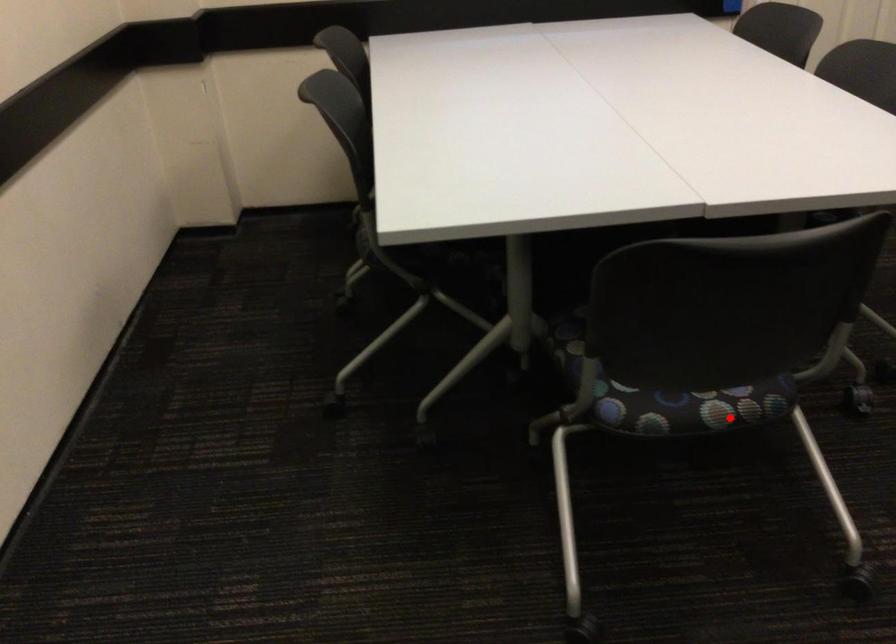
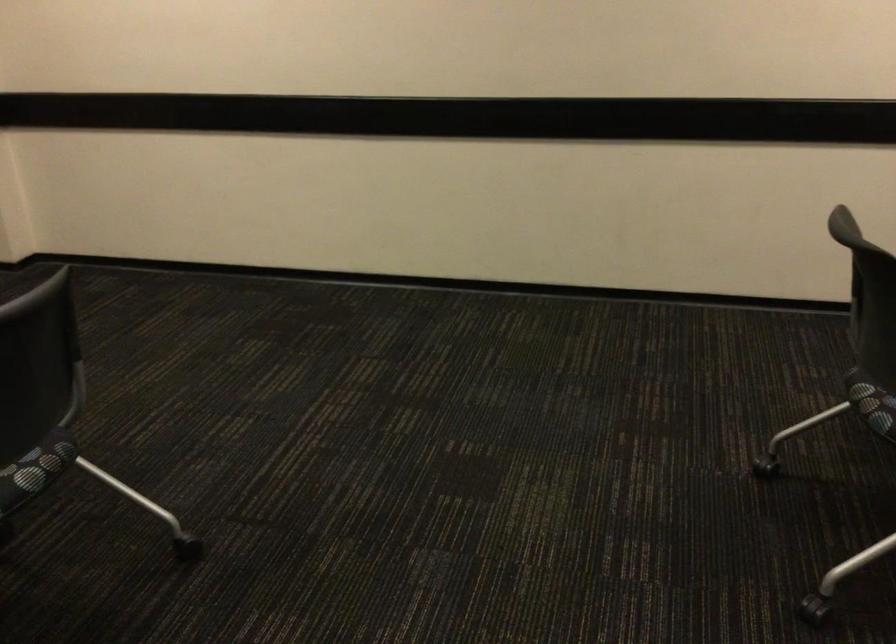
Question: I am providing you with two images of the same scene from different viewpoints. A red point is marked on the first image. Is the red point's position out of view in image 2?

Choices:
 (A) Yes
 (B) No

Answer: (B)